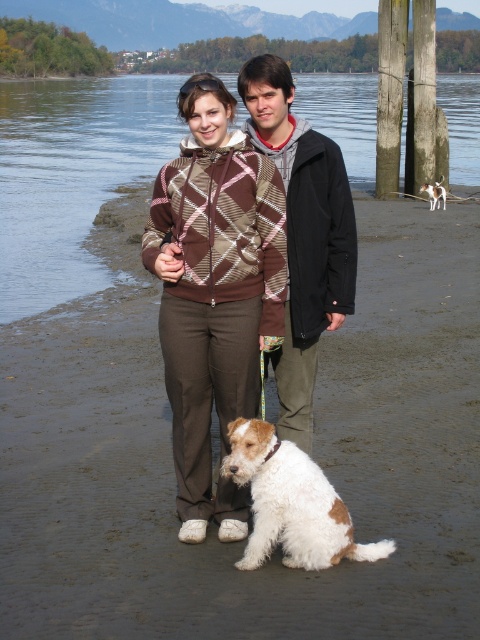
Question: Which object appears closest to the camera in this image?

Choices:
 (A) brown fabric pants at center
 (B) black fleece jacket at center

Answer: (A)

Question: Which of the following is the farthest from the observer?

Choices:
 (A) (456, 173)
 (B) (328, 304)

Answer: (A)

Question: Which of the following is the farthest from the observer?

Choices:
 (A) brown diamond-patterned sweater at center
 (B) clear water at lower left
 (C) black fleece jacket at center
 (D) brown fabric pants at center

Answer: (B)

Question: Observing the image, what is the correct spatial positioning of brown diamond-patterned sweater at center in reference to white fur at lower center?

Choices:
 (A) above
 (B) below

Answer: (B)

Question: Is brown fabric pants at center positioned in front of white-furred dog at lower center?

Choices:
 (A) no
 (B) yes

Answer: (B)

Question: Does brown diamond-patterned sweater at center have a lesser width compared to white fur at lower center?

Choices:
 (A) no
 (B) yes

Answer: (B)